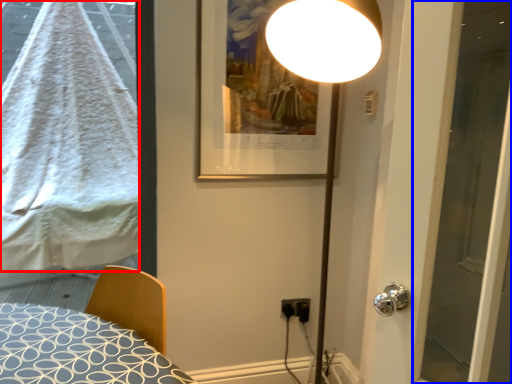
Question: Among these objects, which one is nearest to the camera, blanket (highlighted by a red box) or screen door (highlighted by a blue box)?

Choices:
 (A) blanket
 (B) screen door

Answer: (B)